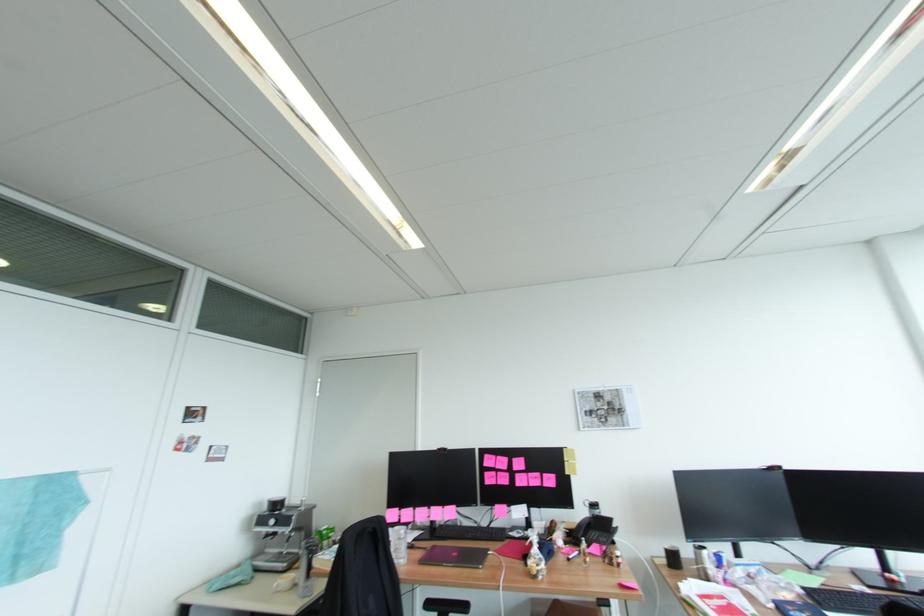
Where would you slid the black computer mouse? Please return your answer as a coordinate pair (x, y).

(898, 609)